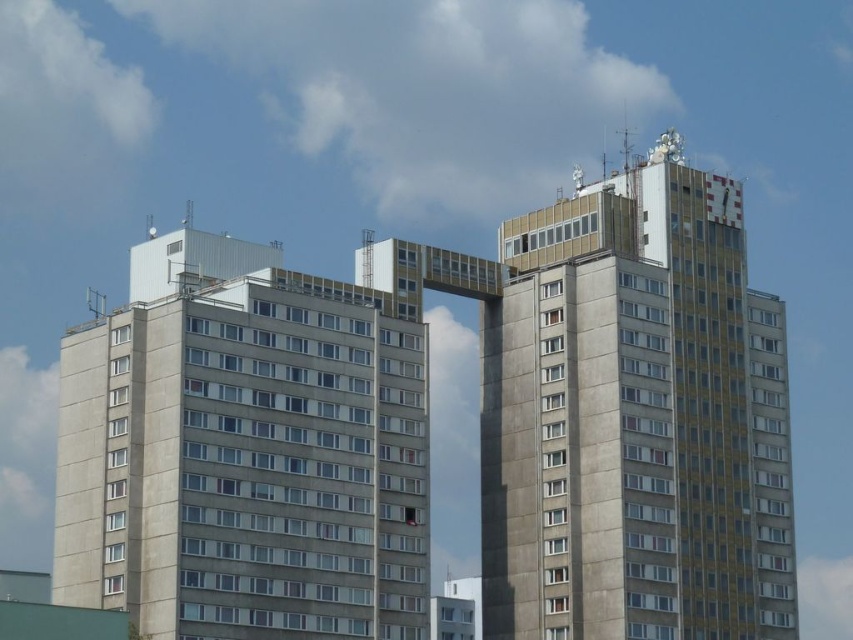
You are a drone operator trying to fly a drone between the two buildings. The drone has a height of 1 meter. Based on the image, can the drone safely pass between the yellowish concrete building at upper right and the gray concrete building at left without hitting any part of the buildings?

The yellowish concrete building at upper right is located above the gray concrete building at left, so there is a vertical gap between them. Since the drone is only 1 meter in height, it should be able to pass safely between the two buildings as long as it navigates through the space below the connecting bridge structure.

You are an architect analyzing the two buildings in the image. The yellowish concrete building at upper right and the gray concrete building at left are part of a planned renovation. The city requires that the smaller building must have a green roof installed. Which building will need the green roof installation?

The yellowish concrete building at upper right has a smaller size compared to gray concrete building at left, so it will need the green roof installation.